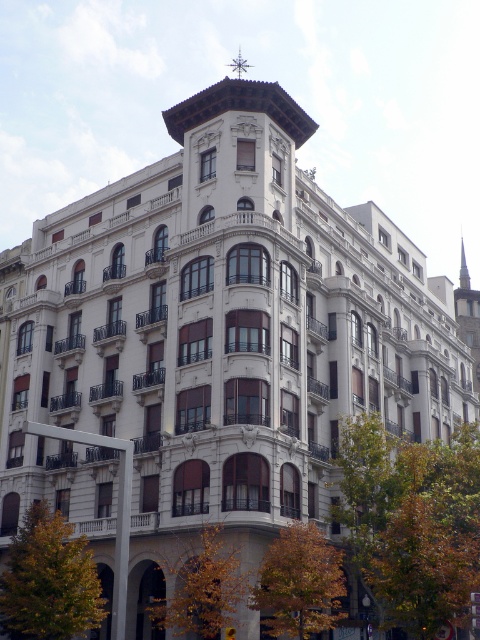
You are standing in front of the grand building and want to take a photo that includes both green leafy tree at lower right and green leafy tree at lower left. Which tree should you position closer to the center of your camera frame to ensure both are fully visible?

The green leafy tree at lower right is wider than the green leafy tree at lower left, so positioning the wider tree closer to the center of the camera frame will help ensure both are fully visible.

You are a landscape architect planning to plant a new tree in front of the grand building. You have two options from the image, the green leafy tree at lower left and the yellow leafy tree at lower center. Which tree would you choose if you want a larger tree to frame the entrance more effectively?

The green leafy tree at lower left is bigger than the yellow leafy tree at lower center, so choosing the green leafy tree at lower left would provide a larger tree to effectively frame the entrance of the grand building.

You are standing at the entrance of the grand building and want to take a photo of the green leafy tree at lower right. To ensure the tree is in the frame, where should you position yourself relative to the building?

The green leafy tree at lower right is located at coordinates point (411, 522), so you should position yourself at the lower right side of the building to capture it in your photo.